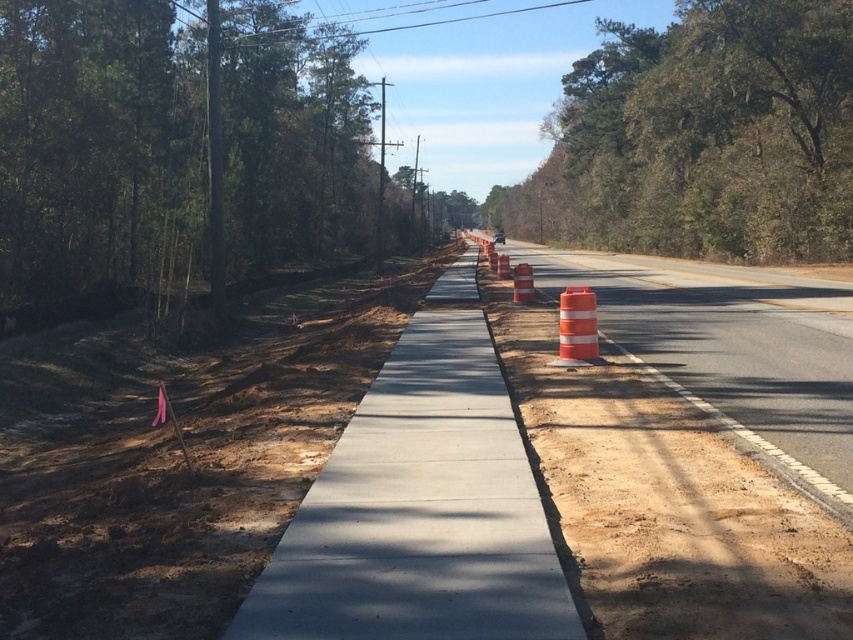
Question: Is green leafy tree at left smaller than smooth concrete sidewalk at center?

Choices:
 (A) no
 (B) yes

Answer: (A)

Question: Which point is closer to the camera?

Choices:
 (A) green leafy tree at upper center
 (B) smooth concrete sidewalk at center
 (C) orange reflective cone at center

Answer: (B)

Question: Which is nearer to the green leafy tree at left?

Choices:
 (A) smooth concrete sidewalk at center
 (B) green leafy tree at upper center

Answer: (A)

Question: Is green leafy tree at upper center thinner than smooth concrete sidewalk at center?

Choices:
 (A) no
 (B) yes

Answer: (A)

Question: Is green leafy tree at left bigger than green leafy tree at upper center?

Choices:
 (A) yes
 (B) no

Answer: (B)

Question: Which point appears closest to the camera in this image?

Choices:
 (A) (384, 529)
 (B) (578, 307)
 (C) (105, 186)

Answer: (A)